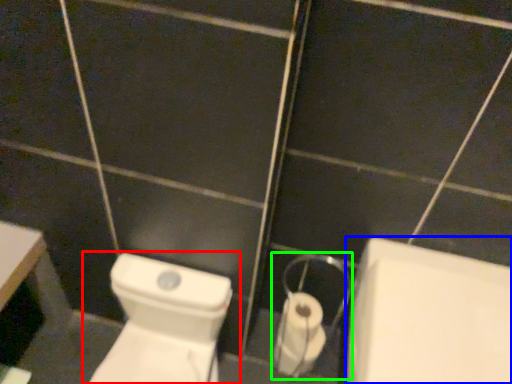
Question: Considering the real-world distances, which object is closest to toilet (highlighted by a red box)? bath (highlighted by a blue box) or dispenser (highlighted by a green box).

Choices:
 (A) bath
 (B) dispenser

Answer: (B)